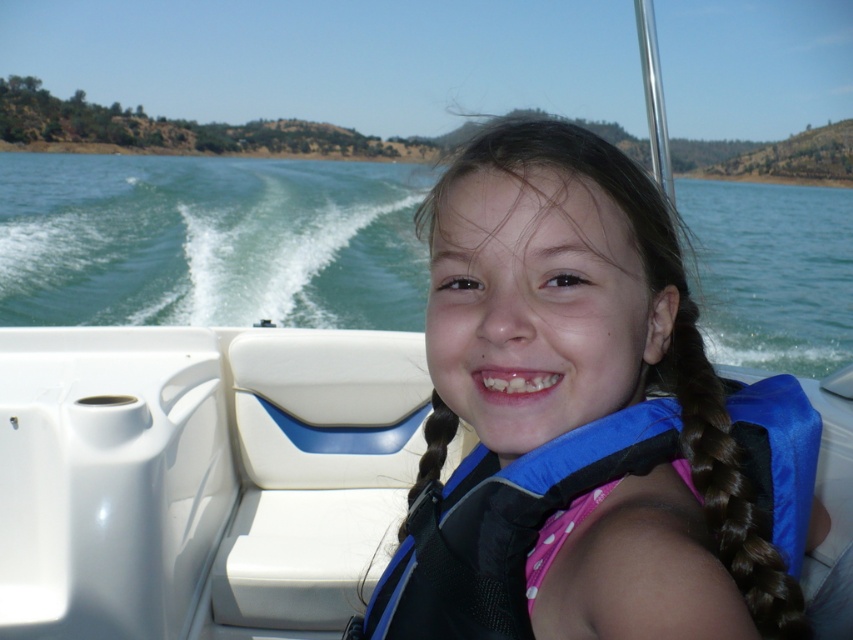
Question: Which point is farther to the camera?

Choices:
 (A) (671, 355)
 (B) (100, 385)
 (C) (520, 557)

Answer: (B)

Question: Is blue water at center positioned behind brown silky hair at center?

Choices:
 (A) yes
 (B) no

Answer: (A)

Question: Does blue water at center have a smaller size compared to blue fabric life jacket at center?

Choices:
 (A) yes
 (B) no

Answer: (B)

Question: Is white plastic boat at center to the right of blue water at center from the viewer's perspective?

Choices:
 (A) yes
 (B) no

Answer: (B)

Question: Which point is farther from the camera taking this photo?

Choices:
 (A) (x=437, y=596)
 (B) (x=343, y=364)

Answer: (B)

Question: Which of the following is the closest to the observer?

Choices:
 (A) (809, 387)
 (B) (569, 352)
 (C) (677, 358)

Answer: (B)